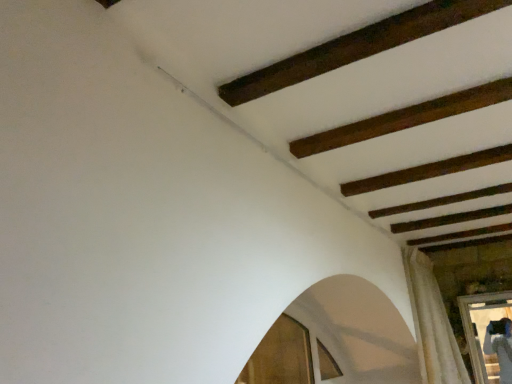
Question: Is wooden frame at lower right taller or shorter than white textured curtain at lower right?

Choices:
 (A) tall
 (B) short

Answer: (B)

Question: Which is correct: wooden frame at lower right is inside white textured curtain at lower right, or outside of it?

Choices:
 (A) inside
 (B) outside

Answer: (A)

Question: Considering the positions of wooden frame at lower right and white textured curtain at lower right in the image, is wooden frame at lower right wider or thinner than white textured curtain at lower right?

Choices:
 (A) thin
 (B) wide

Answer: (A)

Question: Is point (415, 296) positioned closer to the camera than point (483, 314)?

Choices:
 (A) closer
 (B) farther

Answer: (A)

Question: Is white textured curtain at lower right wider or thinner than wooden frame at lower right?

Choices:
 (A) thin
 (B) wide

Answer: (B)

Question: Is white textured curtain at lower right situated inside wooden frame at lower right or outside?

Choices:
 (A) inside
 (B) outside

Answer: (B)

Question: In terms of height, does white textured curtain at lower right look taller or shorter compared to wooden frame at lower right?

Choices:
 (A) short
 (B) tall

Answer: (B)